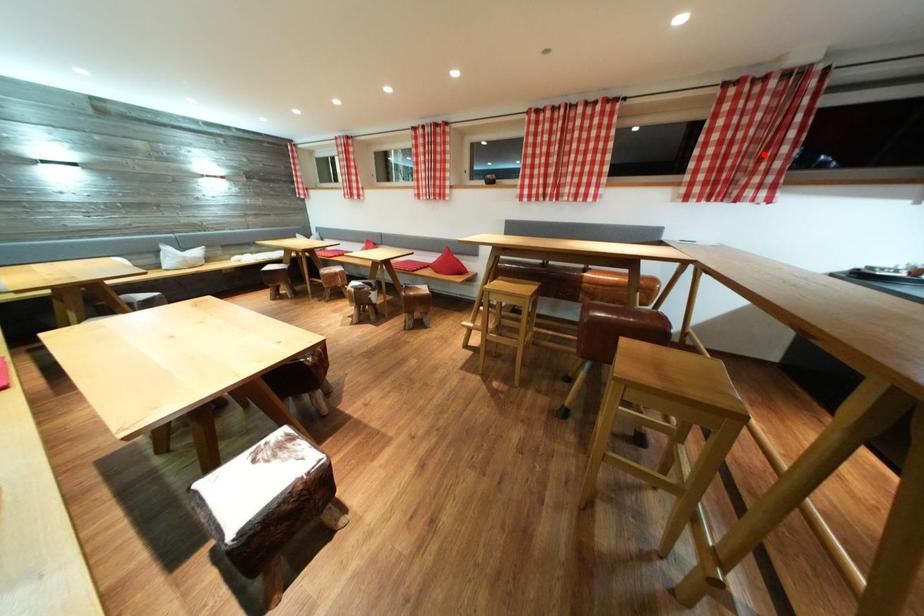
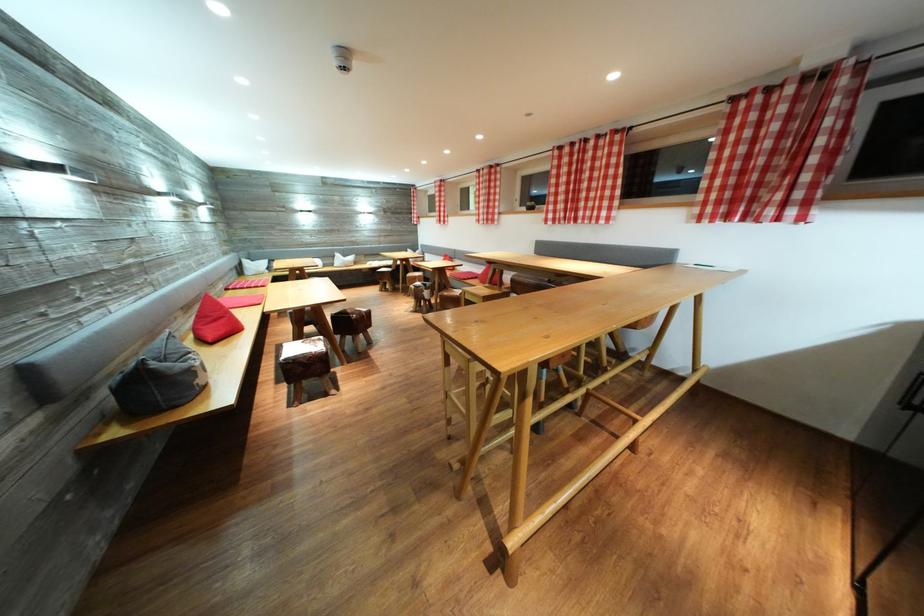
In the second image, find the point that corresponds to the highlighted location in the first image.

(787, 167)